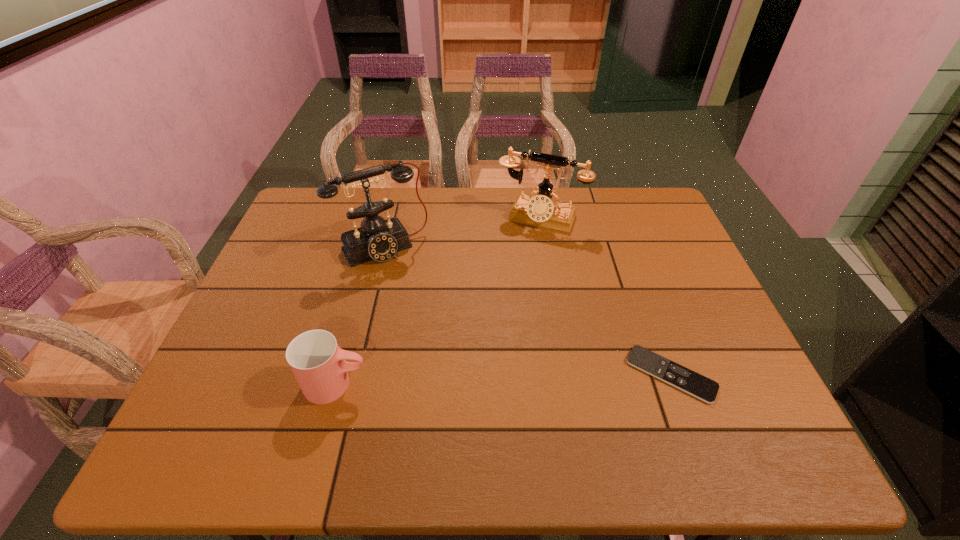
Identify the location of empty location between the cup and the left telephone. (360, 316).

Find the location of `vacant space in between the third shortest object and the left telephone`. vacant space in between the third shortest object and the left telephone is located at coordinates coord(462,233).

You are a GUI agent. You are given a task and a screenshot of the screen. Output one action in this format:
    pyautogui.click(x=<x>, y=<y>)
    Task: Click on the empty space between the third tallest object and the rightmost object
    The image size is (960, 540).
    Given the screenshot: What is the action you would take?
    pyautogui.click(x=504, y=379)

Where is `free point between the shorter telephone and the cup`? free point between the shorter telephone and the cup is located at coordinates (439, 301).

Where is `free space between the second shortest object and the right telephone`? Image resolution: width=960 pixels, height=540 pixels. free space between the second shortest object and the right telephone is located at coordinates (439, 301).

You are a GUI agent. You are given a task and a screenshot of the screen. Output one action in this format:
    pyautogui.click(x=<x>, y=<y>)
    Task: Click on the object that can be found as the third closest to the second shortest object
    
    Given the screenshot: What is the action you would take?
    pyautogui.click(x=693, y=383)

Select which object appears as the third closest to the third object from left to right. Please provide its 2D coordinates. Your answer should be formatted as a tuple, i.e. [(x, y)], where the tuple contains the x and y coordinates of a point satisfying the conditions above.

[(318, 363)]